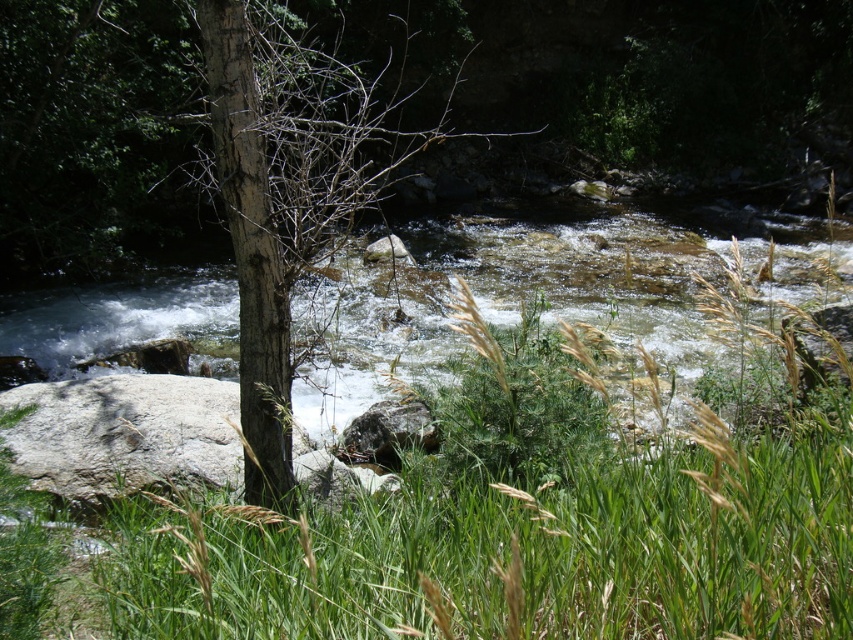
You are a hiker trying to cross the river. You see the clear water at center and the gray rough rock at center. Which object should you step on to avoid getting wet?

You should step on the gray rough rock at center because the clear water at center is positioned over it, meaning the rock is under the water and stepping on it would provide a stable, dry footing.

You are standing at the edge of the river and see two points in the scene. The first is point at point (247,42) and the second is point at point (402,248). Which point is closer to you?

Point at point (247,42) is closer to you than point at point (402,248).